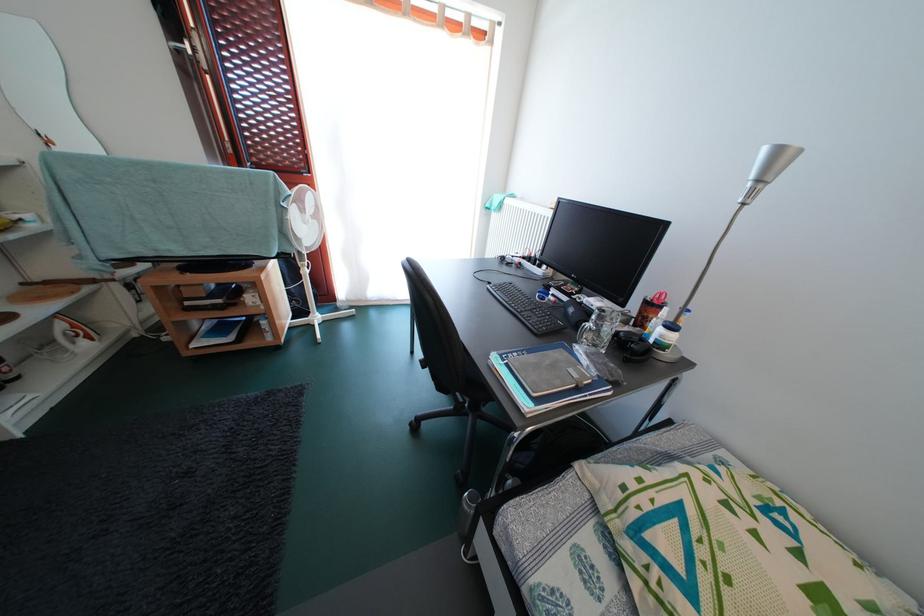
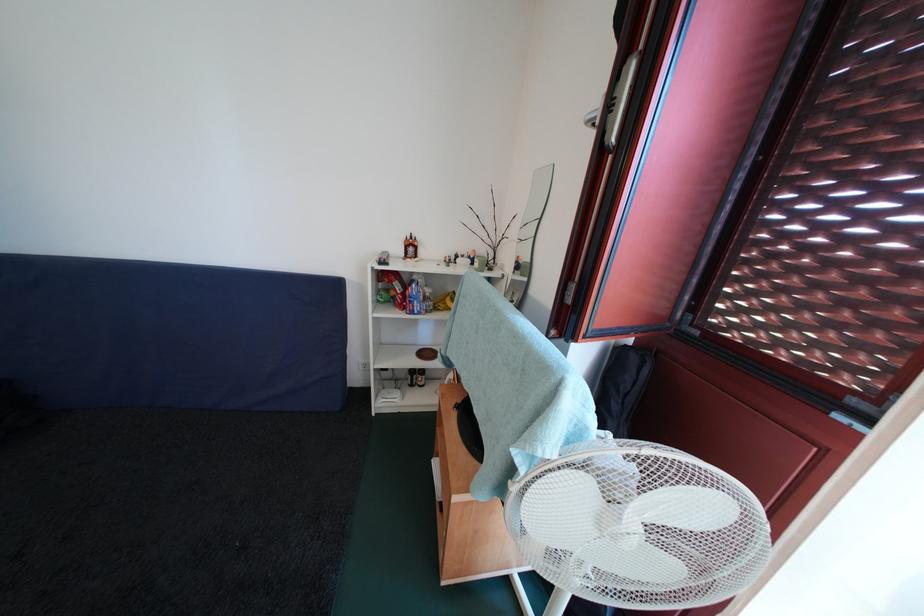
Locate, in the second image, the point that corresponds to (201,55) in the first image.

(616, 110)